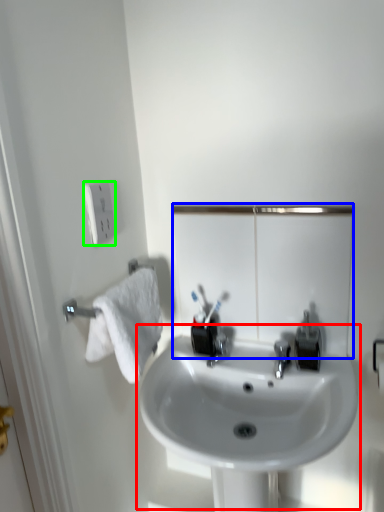
Question: Which is farther away from sink (highlighted by a red box)? mirror (highlighted by a blue box) or electric outlet (highlighted by a green box)?

Choices:
 (A) mirror
 (B) electric outlet

Answer: (B)